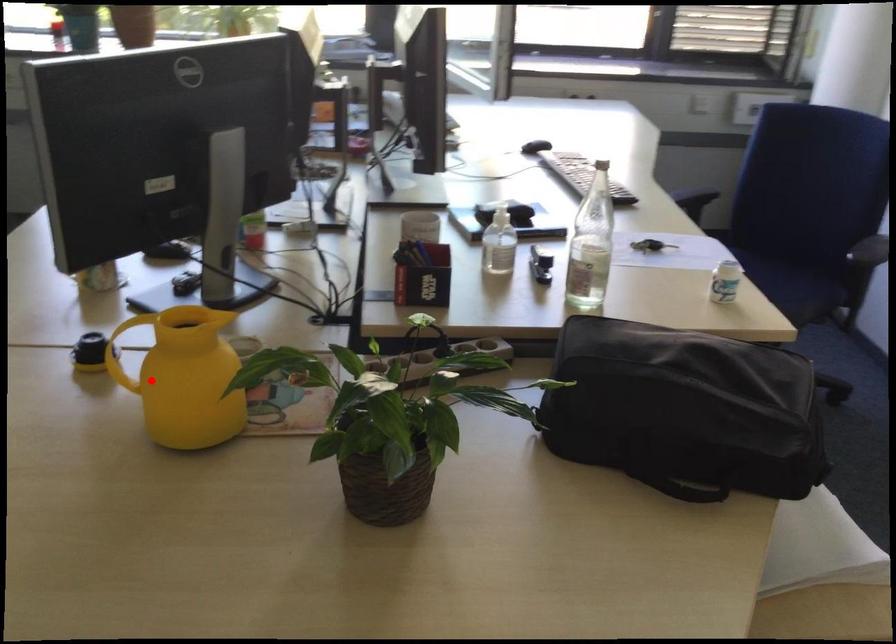
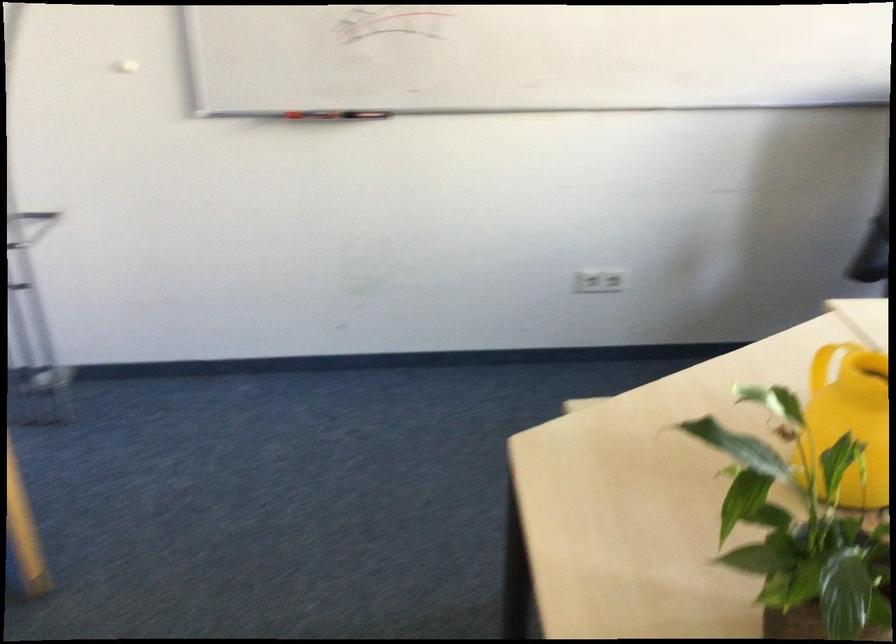
Question: I am providing you with two images of the same scene from different viewpoints. A red point is shown in image1. For the corresponding object point in image2, is it positioned nearer or farther from the camera?

Choices:
 (A) Nearer
 (B) Farther

Answer: (A)